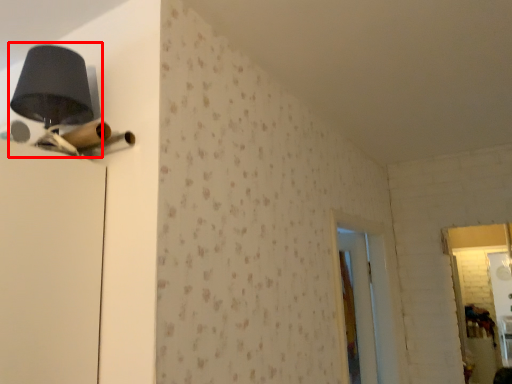
Question: Where is table lamp (annotated by the red box) located in relation to screen door in the image?

Choices:
 (A) left
 (B) right

Answer: (A)